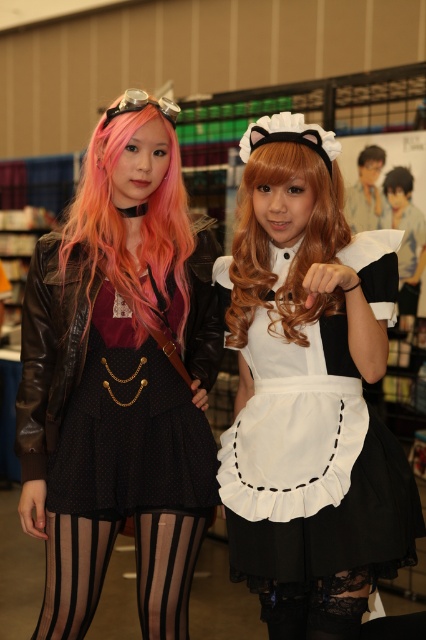
You are organizing a photoshoot and need to place the white satin dress at center and the black matte hair at upper right in a way that maintains their visibility. Given their sizes, which object should be placed closer to the camera to ensure both are clearly visible?

The white satin dress at center has a larger width than the black matte hair at upper right, so placing the white satin dress at center closer to the camera will help maintain visibility for both objects.